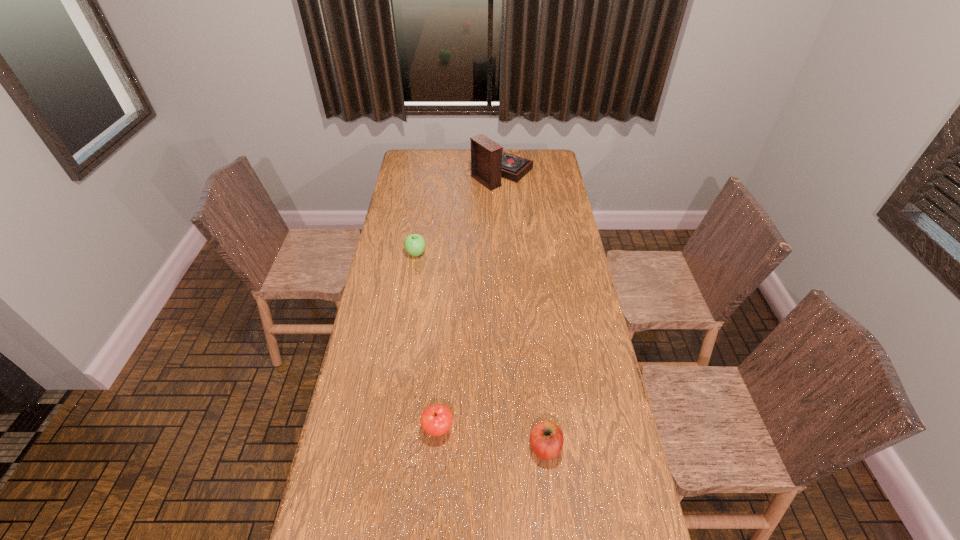
Where is `the tallest object`? This screenshot has width=960, height=540. the tallest object is located at coordinates (489, 163).

At what (x,y) coordinates should I click in order to perform the action: click on the farthest object. Please return your answer as a coordinate pair (x, y). Looking at the image, I should click on (489, 163).

At what (x,y) coordinates should I click in order to perform the action: click on the rightmost apple. Please return your answer as a coordinate pair (x, y). Looking at the image, I should click on (546, 438).

Where is `the second apple from left to right`? Image resolution: width=960 pixels, height=540 pixels. the second apple from left to right is located at coordinates point(436,420).

Locate an element on the screen. the farthest apple is located at coordinates (414, 244).

Where is `the leftmost object`? The width and height of the screenshot is (960, 540). the leftmost object is located at coordinates (414, 244).

This screenshot has width=960, height=540. I want to click on blank space located 0.340m on the left of the phonograph record, so click(400, 173).

Where is `vacant space located on the back of the rightmost apple`? The width and height of the screenshot is (960, 540). vacant space located on the back of the rightmost apple is located at coordinates (535, 351).

Where is `free space located 0.340m on the right of the second apple from left to right`? This screenshot has width=960, height=540. free space located 0.340m on the right of the second apple from left to right is located at coordinates (566, 428).

In order to click on blank space located on the left of the third nearest object in this screenshot , I will do `click(389, 253)`.